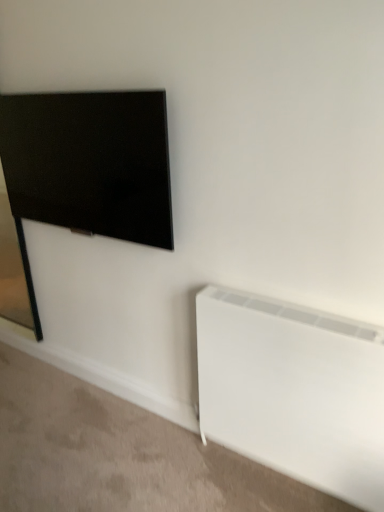
This screenshot has height=512, width=384. Find the location of `matte black tv at upper left`. matte black tv at upper left is located at coordinates (90, 162).

What do you see at coordinates (90, 162) in the screenshot? I see `matte black tv at upper left` at bounding box center [90, 162].

Describe the element at coordinates (294, 391) in the screenshot. I see `white matte radiator at lower right` at that location.

Locate an element on the screen. white matte radiator at lower right is located at coordinates (294, 391).

The image size is (384, 512). I want to click on matte black tv at upper left, so click(x=90, y=162).

Considering the positions of objects matte black tv at upper left and white matte radiator at lower right in the image provided, who is more to the left, matte black tv at upper left or white matte radiator at lower right?

matte black tv at upper left is more to the left.

Between matte black tv at upper left and white matte radiator at lower right, which one is positioned behind?

matte black tv at upper left is further from the camera.

Considering the positions of point (26, 180) and point (381, 410), is point (26, 180) closer or farther from the camera than point (381, 410)?

Clearly, point (26, 180) is more distant from the camera than point (381, 410).

From the image's perspective, is matte black tv at upper left on top of white matte radiator at lower right?

Yes, from the image's perspective, matte black tv at upper left is on top of white matte radiator at lower right.

From a real-world perspective, between matte black tv at upper left and white matte radiator at lower right, who is vertically higher?

matte black tv at upper left is physically above.

Is matte black tv at upper left wider or thinner than white matte radiator at lower right?

Considering their sizes, matte black tv at upper left looks slimmer than white matte radiator at lower right.

Between matte black tv at upper left and white matte radiator at lower right, which one has more height?

With more height is white matte radiator at lower right.

In terms of size, does matte black tv at upper left appear bigger or smaller than white matte radiator at lower right?

Considering their sizes, matte black tv at upper left takes up less space than white matte radiator at lower right.

Is white matte radiator at lower right completely or partially inside matte black tv at upper left?

No.

Is there a large distance between matte black tv at upper left and white matte radiator at lower right?

matte black tv at upper left is near white matte radiator at lower right, not far away.

Is matte black tv at upper left aimed at white matte radiator at lower right?

No, matte black tv at upper left is not turned towards white matte radiator at lower right.

What's the angular difference between matte black tv at upper left and white matte radiator at lower right's facing directions?

The angular difference between matte black tv at upper left and white matte radiator at lower right is 1.1 degrees.

Where is `radiator directly beneath the matte black tv at upper left (from a real-world perspective)`? Image resolution: width=384 pixels, height=512 pixels. radiator directly beneath the matte black tv at upper left (from a real-world perspective) is located at coordinates (294, 391).

Is white matte radiator at lower right to the left of matte black tv at upper left from the viewer's perspective?

Incorrect, white matte radiator at lower right is not on the left side of matte black tv at upper left.

Is white matte radiator at lower right behind matte black tv at upper left?

No, the depth of white matte radiator at lower right is less than that of matte black tv at upper left.

Which is behind, point (213, 362) or point (127, 239)?

The point (127, 239) is farther from the camera.

From the image's perspective, is white matte radiator at lower right located above matte black tv at upper left?

No, from the image's perspective, white matte radiator at lower right is not over matte black tv at upper left.

From a real-world perspective, between white matte radiator at lower right and matte black tv at upper left, who is vertically lower?

In real-world perspective, white matte radiator at lower right is lower.

Between white matte radiator at lower right and matte black tv at upper left, which one has larger width?

white matte radiator at lower right.

In terms of height, does white matte radiator at lower right look taller or shorter compared to matte black tv at upper left?

Clearly, white matte radiator at lower right is taller compared to matte black tv at upper left.

Does white matte radiator at lower right have a smaller size compared to matte black tv at upper left?

No, white matte radiator at lower right is not smaller than matte black tv at upper left.

Choose the correct answer: Is white matte radiator at lower right inside matte black tv at upper left or outside it?

white matte radiator at lower right lies outside matte black tv at upper left.

Would you say white matte radiator at lower right is a long distance from matte black tv at upper left?

They are positioned close to each other.

Is matte black tv at upper left at the back of white matte radiator at lower right?

No.

At what (x,y) coordinates should I click in order to perform the action: click on radiator on the right of matte black tv at upper left. Please return your answer as a coordinate pair (x, y). This screenshot has width=384, height=512. Looking at the image, I should click on (294, 391).

In order to click on television that is behind the white matte radiator at lower right in this screenshot , I will do `click(90, 162)`.

The image size is (384, 512). In order to click on radiator that appears below the matte black tv at upper left (from the image's perspective) in this screenshot , I will do `click(294, 391)`.